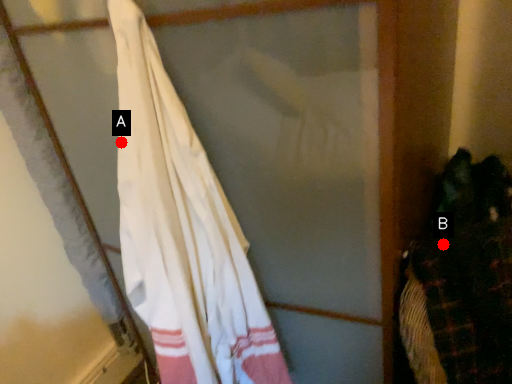
Question: Two points are circled on the image, labeled by A and B beside each circle. Among these points, which one is farthest from the camera?

Choices:
 (A) A is further
 (B) B is further

Answer: (B)